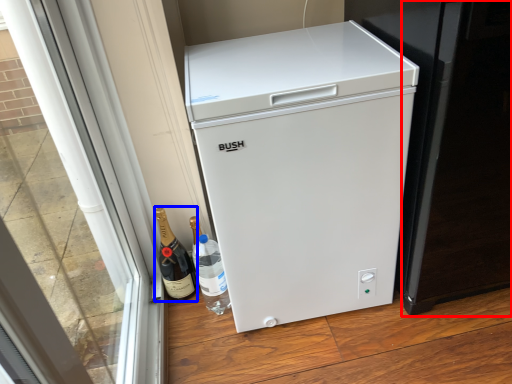
Question: Which object is closer to the camera taking this photo, screen door (highlighted by a red box) or wine (highlighted by a blue box)?

Choices:
 (A) screen door
 (B) wine

Answer: (A)